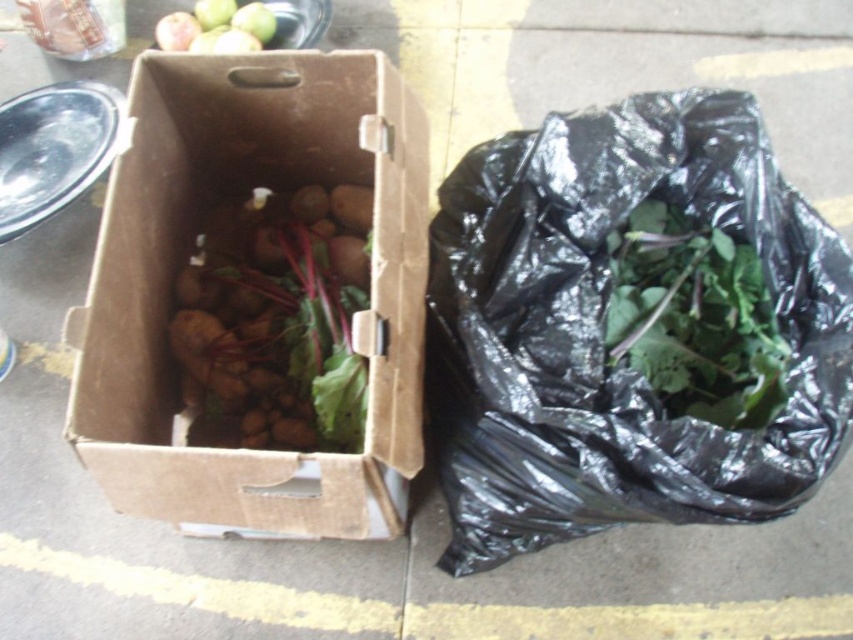
Question: Which object is the closest to the brown cardboard box at center?

Choices:
 (A) green leafy at right
 (B) black plastic bag at right

Answer: (B)

Question: Which object is the farthest from the green leafy at right?

Choices:
 (A) brown cardboard box at center
 (B) black plastic bag at right

Answer: (A)

Question: Is black plastic bag at right bigger than brown matte potatoes at center?

Choices:
 (A) yes
 (B) no

Answer: (A)

Question: Is black plastic bag at right further to camera compared to brown matte potatoes at center?

Choices:
 (A) yes
 (B) no

Answer: (A)

Question: Is black plastic bag at right wider than brown matte potatoes at center?

Choices:
 (A) yes
 (B) no

Answer: (A)

Question: Considering the real-world distances, which object is closest to the brown cardboard box at center?

Choices:
 (A) green leafy at right
 (B) black plastic bag at right
 (C) brown matte potatoes at center

Answer: (C)